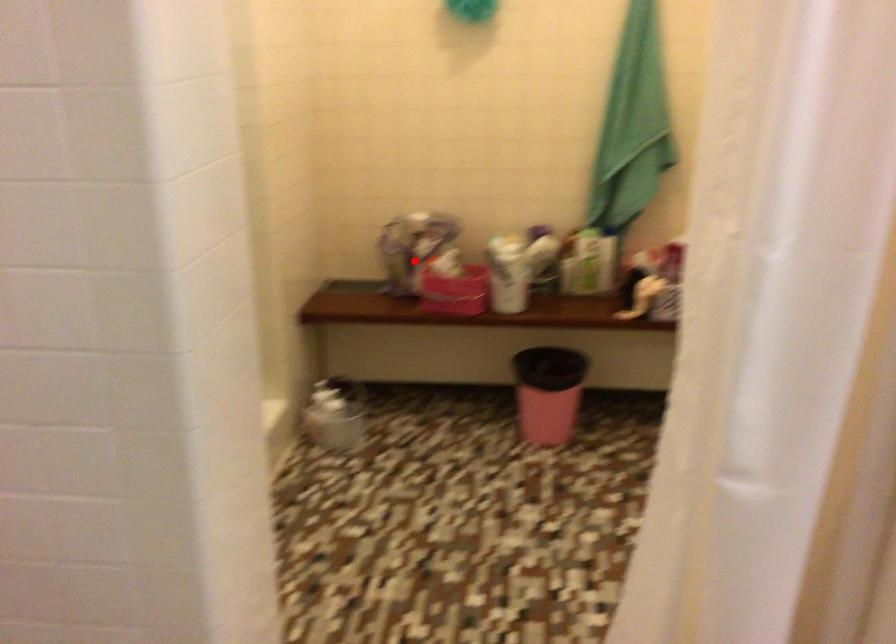
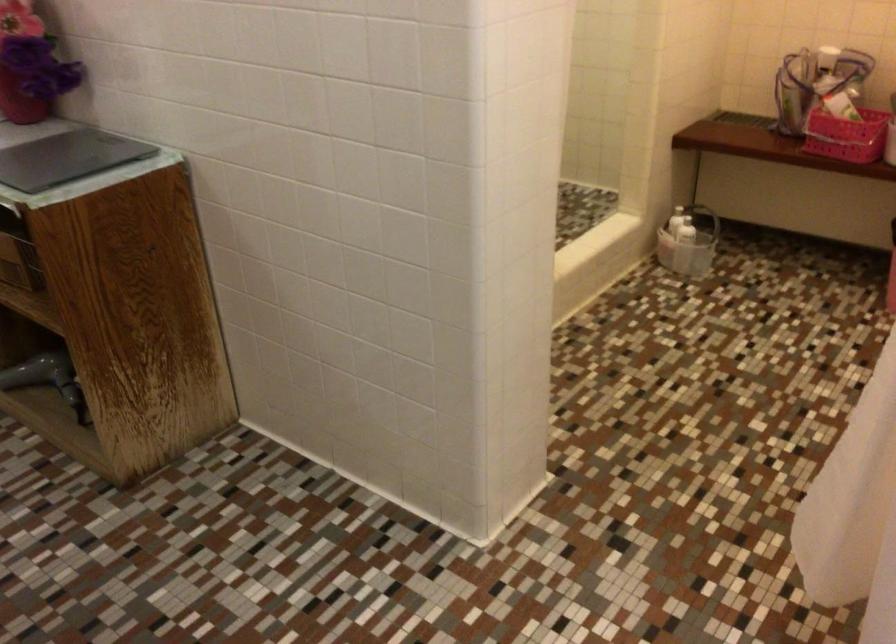
Question: I am providing you with two images of the same scene from different viewpoints. A red point is shown in image1. For the corresponding object point in image2, is it positioned nearer or farther from the camera?

Choices:
 (A) Nearer
 (B) Farther

Answer: (A)